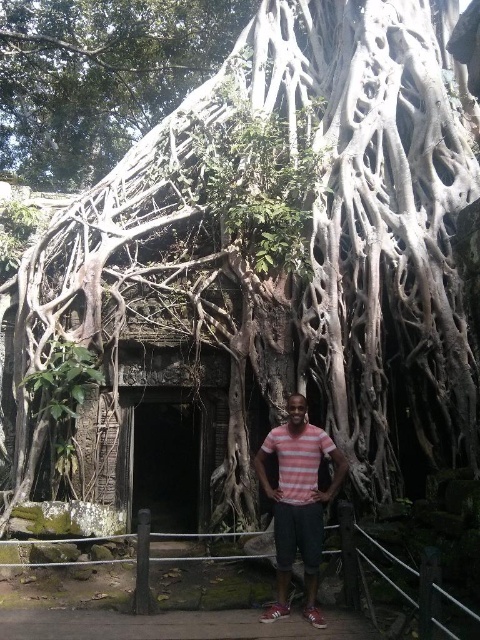
You are standing in front of the large tree and ancient stone structure. There is a point at coordinates (167, 458). Can you tell me what this point is located on?

The point at (167, 458) is located on the dark stone doorway at center.